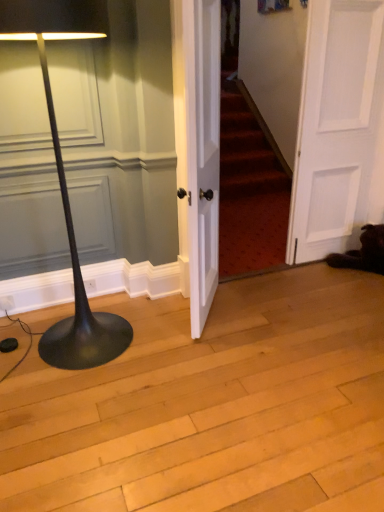
The width and height of the screenshot is (384, 512). What are the coordinates of `free space that is in between black matte floor lamp at left and white wood door at center, the second door when ordered from right to left` in the screenshot? It's located at (153, 333).